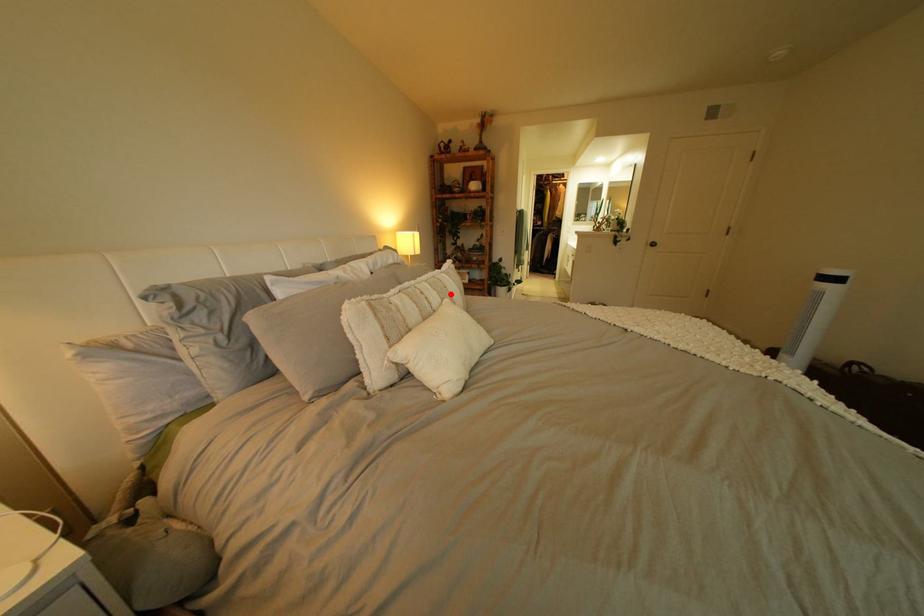
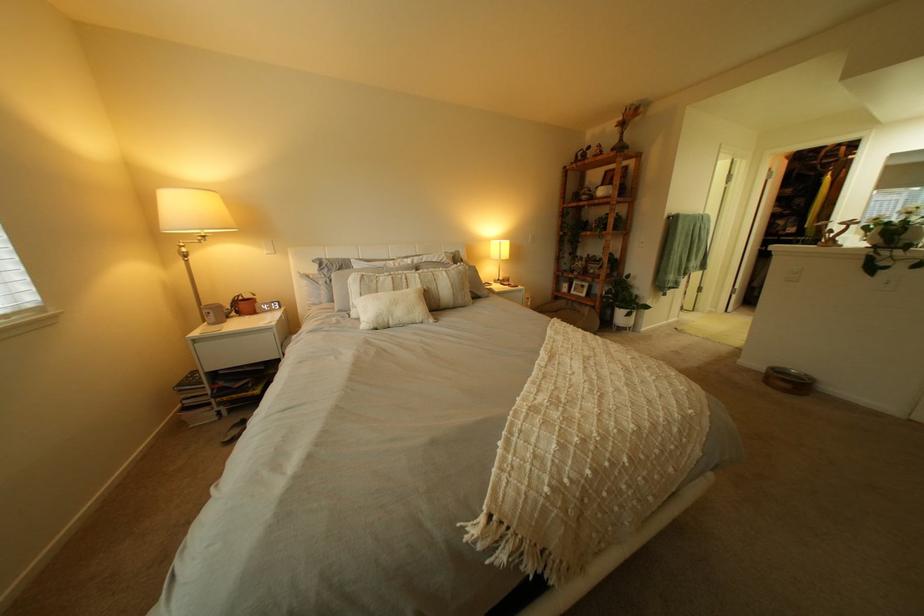
Find the pixel in the second image that matches the highlighted location in the first image.

(434, 283)